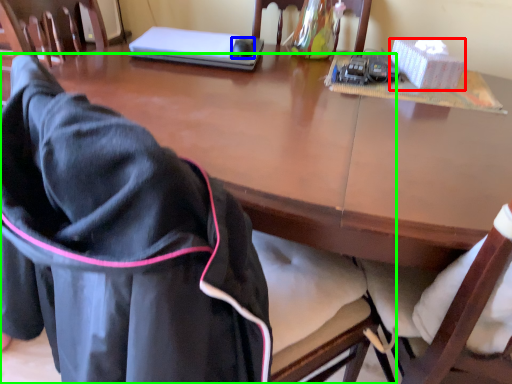
Question: Which is nearer to the box (highlighted by a red box)? mouse (highlighted by a blue box) or chair (highlighted by a green box).

Choices:
 (A) mouse
 (B) chair

Answer: (A)